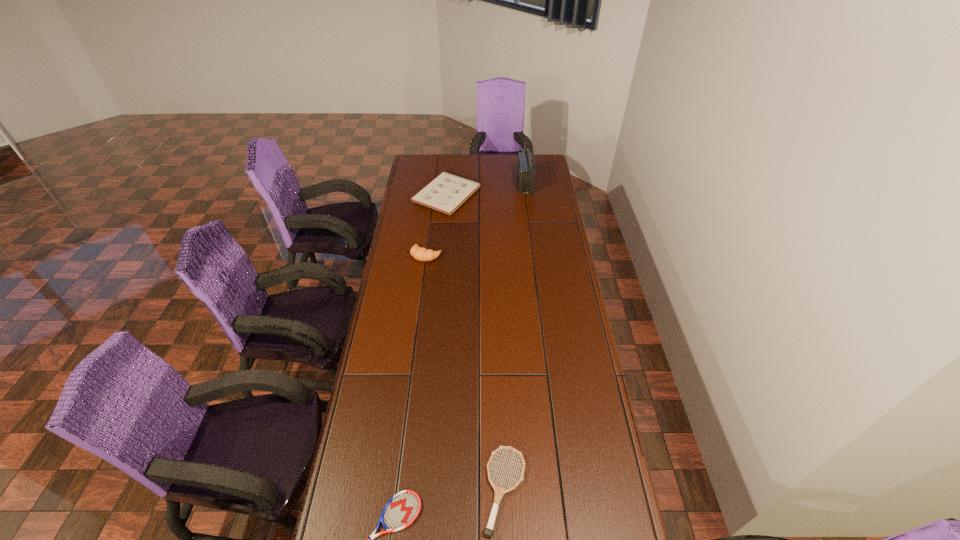
At what (x,y) coordinates should I click in order to perform the action: click on vacant space located on the right of the crescent roll. Please return your answer as a coordinate pair (x, y). This screenshot has height=540, width=960. Looking at the image, I should click on (455, 255).

At what (x,y) coordinates should I click in order to perform the action: click on free region located 0.360m on the right of the third tallest object. Please return your answer as a coordinate pair (x, y). The height and width of the screenshot is (540, 960). Looking at the image, I should click on (552, 194).

Locate an element on the screen. vacant region located on the back of the right tennis racket is located at coordinates (500, 368).

Locate an element on the screen. The height and width of the screenshot is (540, 960). radio receiver present at the far edge is located at coordinates (525, 171).

This screenshot has width=960, height=540. In order to click on notepad that is at the far edge in this screenshot , I will do `click(446, 192)`.

Locate an element on the screen. crescent roll at the left edge is located at coordinates (422, 254).

At what (x,y) coordinates should I click in order to perform the action: click on notepad that is at the left edge. Please return your answer as a coordinate pair (x, y). Looking at the image, I should click on (446, 192).

The height and width of the screenshot is (540, 960). Identify the location of object located at the right edge. (525, 171).

This screenshot has width=960, height=540. I want to click on object at the far left corner, so click(x=446, y=192).

Image resolution: width=960 pixels, height=540 pixels. In order to click on object that is at the far right corner in this screenshot , I will do `click(525, 171)`.